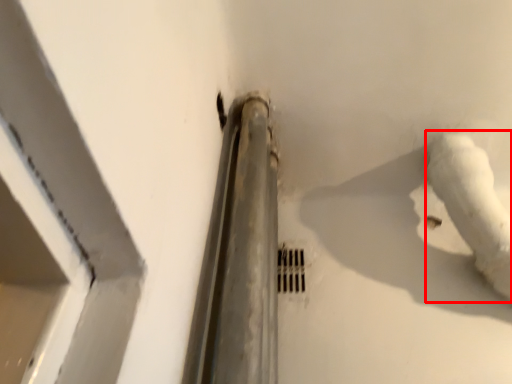
Question: From the image's perspective, what is the correct spatial relationship of water pipe (annotated by the red box) in relation to hole?

Choices:
 (A) above
 (B) below

Answer: (A)